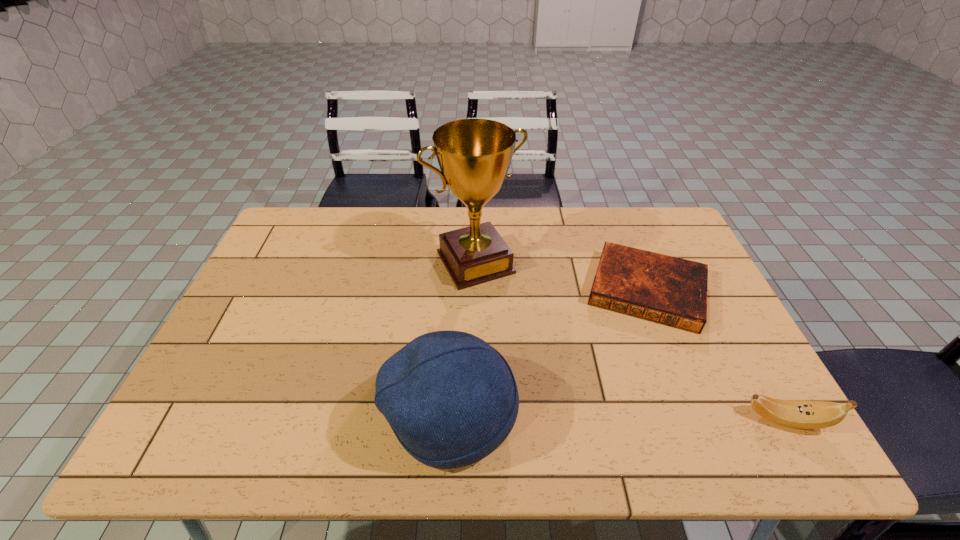
Image resolution: width=960 pixels, height=540 pixels. What are the coordinates of `free space at the left edge` in the screenshot? It's located at 246,320.

In the image, there is a desktop. Where is `vacant space at the right edge`? This screenshot has height=540, width=960. vacant space at the right edge is located at coordinates (714, 342).

Where is `free space at the far right corner of the desktop`? The width and height of the screenshot is (960, 540). free space at the far right corner of the desktop is located at coordinates (660, 219).

This screenshot has height=540, width=960. In order to click on blank region between the third tallest object and the tallest object in this screenshot , I will do `click(631, 341)`.

Locate an element on the screen. Image resolution: width=960 pixels, height=540 pixels. free space between the skullcap and the shortest object is located at coordinates (549, 352).

The width and height of the screenshot is (960, 540). I want to click on free spot between the shortest object and the award, so click(x=561, y=276).

Image resolution: width=960 pixels, height=540 pixels. Find the location of `vacant area between the award and the third tallest object`. vacant area between the award and the third tallest object is located at coordinates (631, 341).

Locate an element on the screen. vacant point located between the Bible and the third tallest object is located at coordinates (716, 355).

Where is `free spot between the shortest object and the award`? The image size is (960, 540). free spot between the shortest object and the award is located at coordinates (561, 276).

The image size is (960, 540). What are the coordinates of `vacant point located between the second tallest object and the shortest object` in the screenshot? It's located at (549, 352).